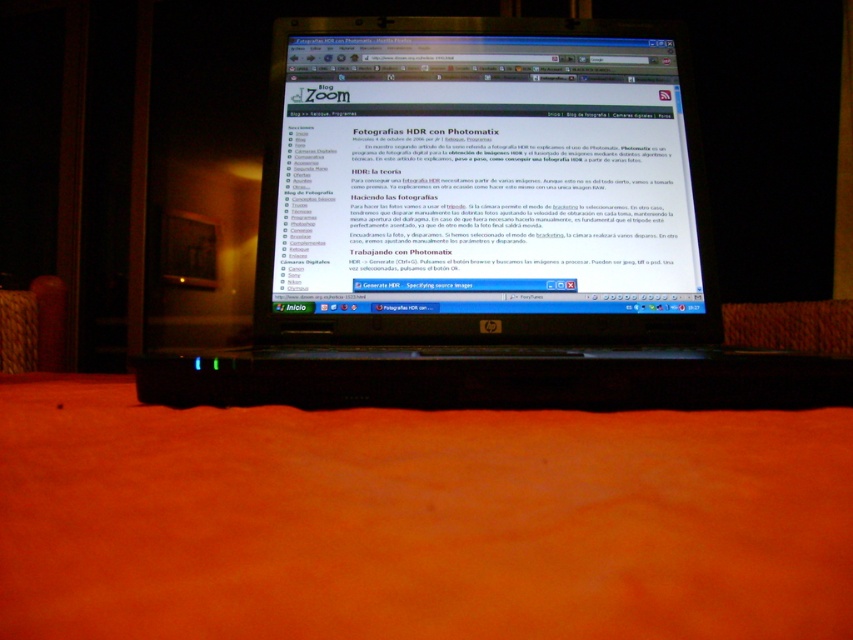
You are trying to set up a dual monitor setup with the black plastic laptop at center and the matte black monitor at center. Based on their sizes, which one should be placed higher on the desk to avoid blocking the other?

The black plastic laptop at center is much taller than the matte black monitor at center, so placing the black plastic laptop at center higher would prevent it from blocking the matte black monitor at center.

You are a photographer who wants to place a small decorative item on the laptop screen without covering the dialog box. The dialog box is located at point (485, 228). Where should you place the item?

The dialog box is located at point (485, 228), so you should place the item away from that area to avoid covering it. The point marks the location of the black plastic laptop at center, so ensure the item is placed elsewhere on the screen.

You are holding a 12 inch ruler and want to measure the distance between yourself and the black plastic laptop at center. According to the image, can your ruler reach the distance?

The distance between the black plastic laptop at center and the viewer is 14.98 inches. Since the ruler is only 12 inches long, it cannot fully measure the distance as it is shorter than required.